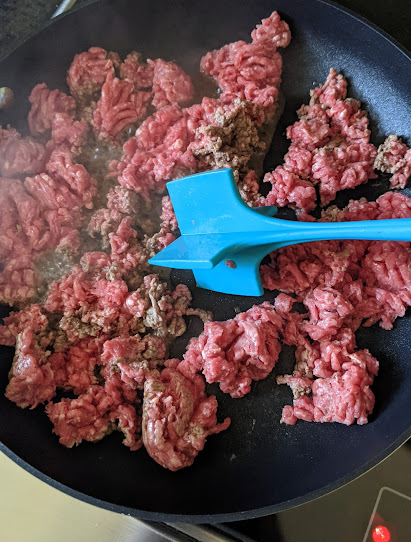
Locate an element on the screen. The width and height of the screenshot is (411, 542). blue plastic meat spatula is located at coordinates (246, 234).